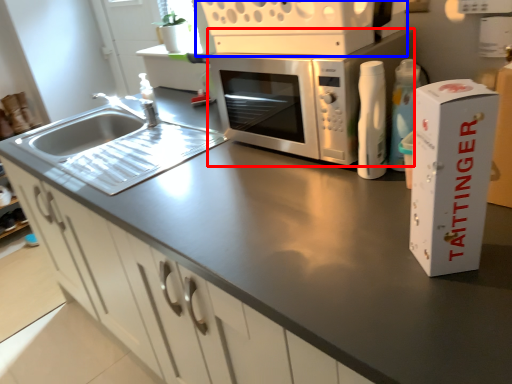
Question: Which object appears farthest to the camera in this image, microwave oven (highlighted by a red box) or appliance (highlighted by a blue box)?

Choices:
 (A) microwave oven
 (B) appliance

Answer: (A)